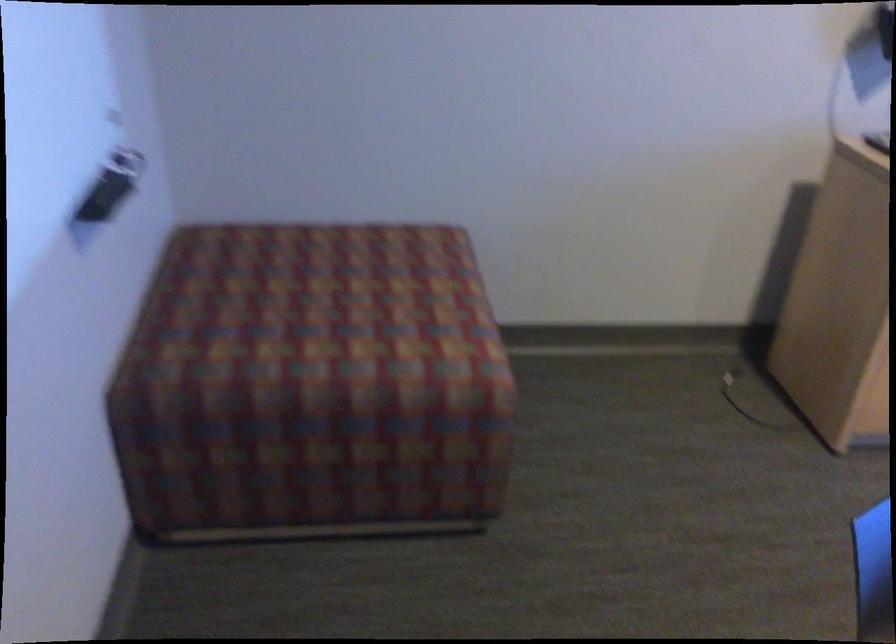
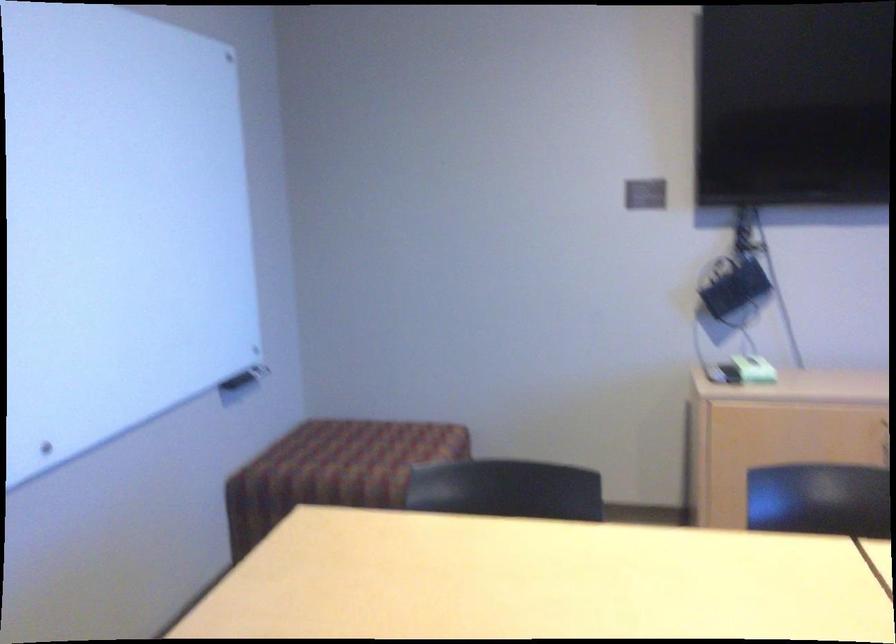
What movement of the cameraman would produce the second image?

The cameraman moved toward right, backward.